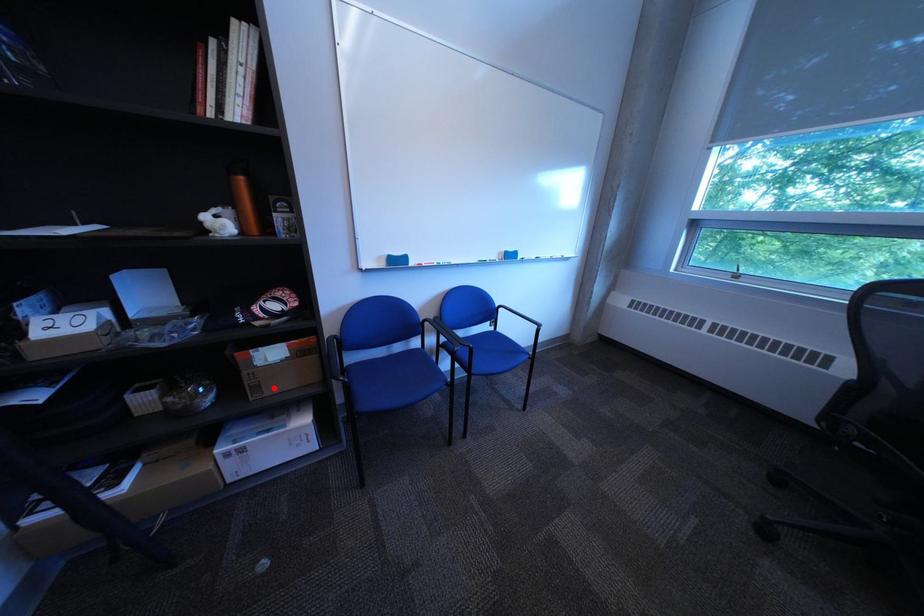
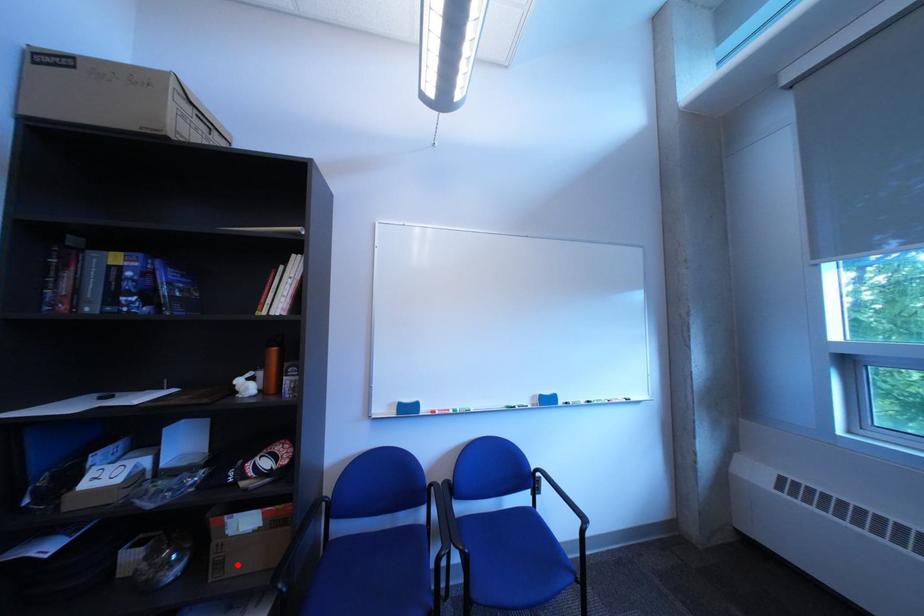
I am providing you with two images of the same scene from different viewpoints. A red point is marked on the first image and another point is marked on the second image. Do the highlighted points in image1 and image2 indicate the same real-world spot?

Yes